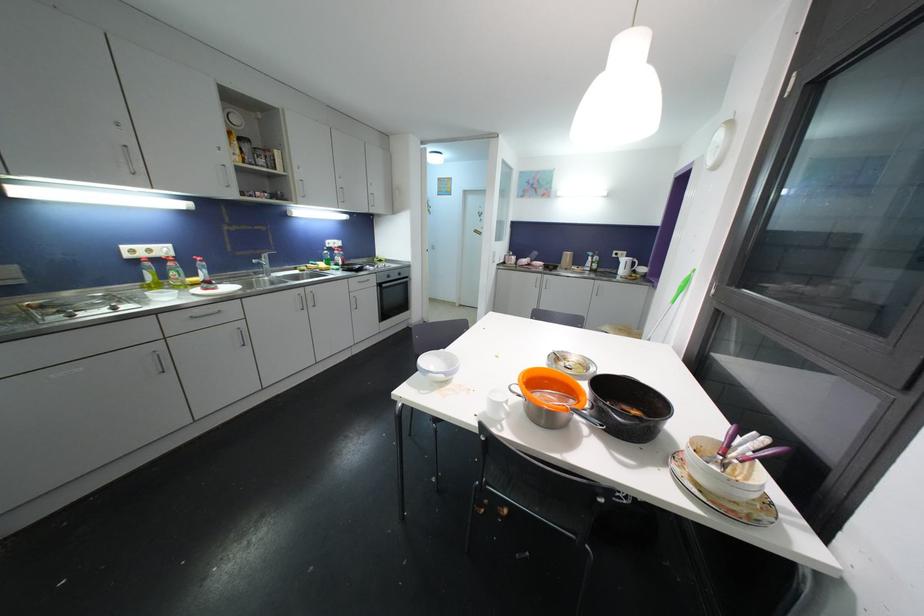
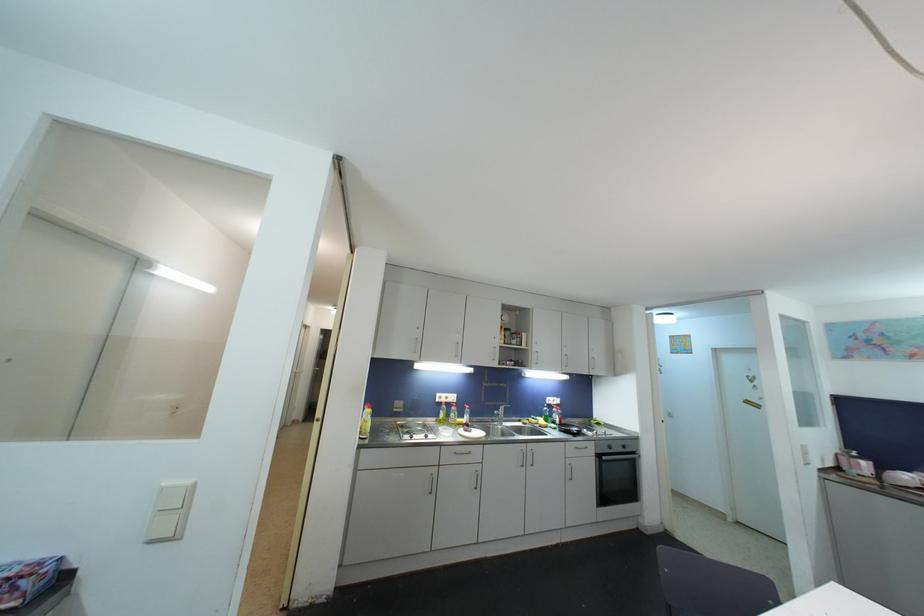
Find the pixel in the second image that matches (152,253) in the first image.

(450, 400)